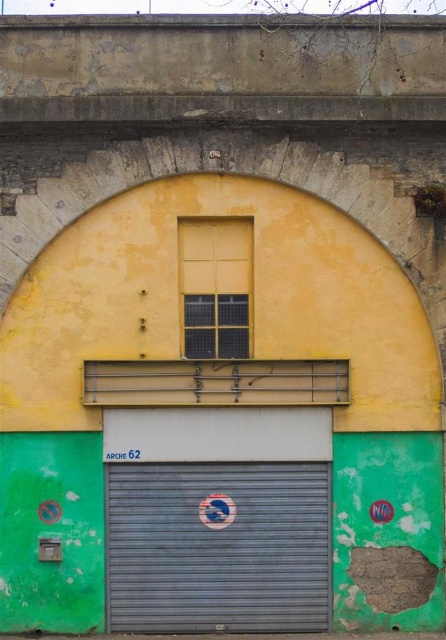
You are a delivery person trying to determine the best way to enter a building. You see a metallic gray garage door at center and a yellow matte window at upper center. Which one is larger and more suitable for entering?

The metallic gray garage door at center is bigger than the yellow matte window at upper center, so it is more suitable for entering as it is larger.